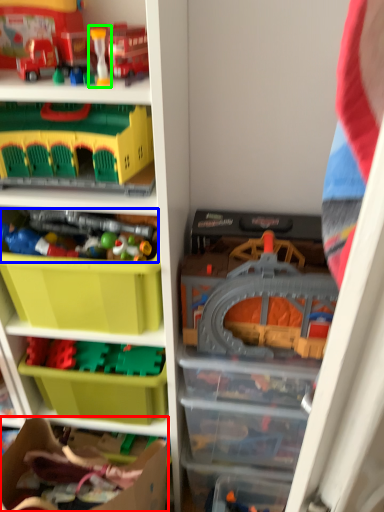
Question: Based on their relative distances, which object is nearer to cardboard box (highlighted by a red box)? Choose from toy (highlighted by a blue box) and toy (highlighted by a green box).

Choices:
 (A) toy
 (B) toy

Answer: (A)